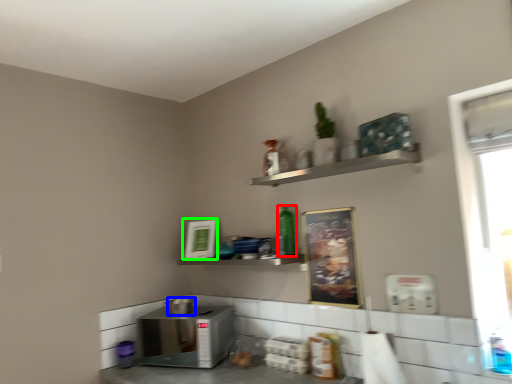
Question: Which is farther away from bottle (highlighted by a red box)? appliance (highlighted by a blue box) or picture frame (highlighted by a green box)?

Choices:
 (A) appliance
 (B) picture frame

Answer: (A)